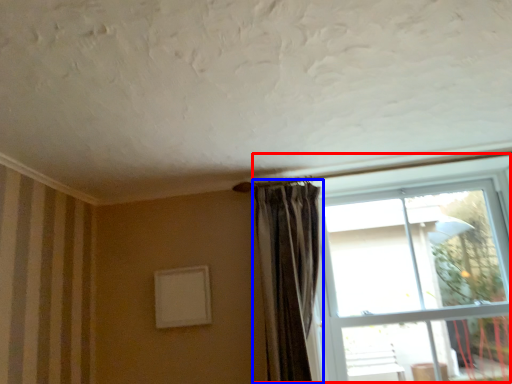
Question: Which of the following is the closest to the observer, window (highlighted by a red box) or curtain (highlighted by a blue box)?

Choices:
 (A) window
 (B) curtain

Answer: (A)